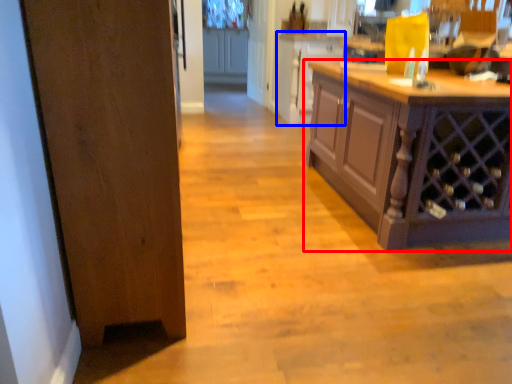
Question: Which object is further to the camera taking this photo, cabinetry (highlighted by a red box) or cabinetry (highlighted by a blue box)?

Choices:
 (A) cabinetry
 (B) cabinetry

Answer: (B)